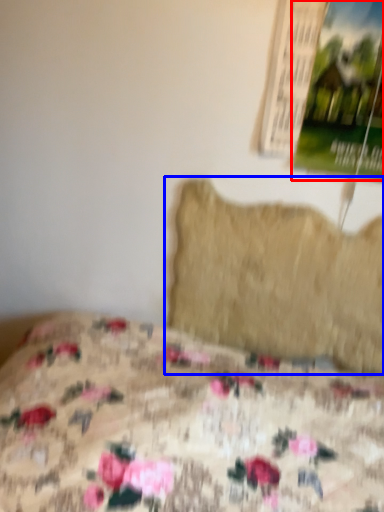
Question: Which of the following is the farthest to the observer, poster page (highlighted by a red box) or pillow (highlighted by a blue box)?

Choices:
 (A) poster page
 (B) pillow

Answer: (B)